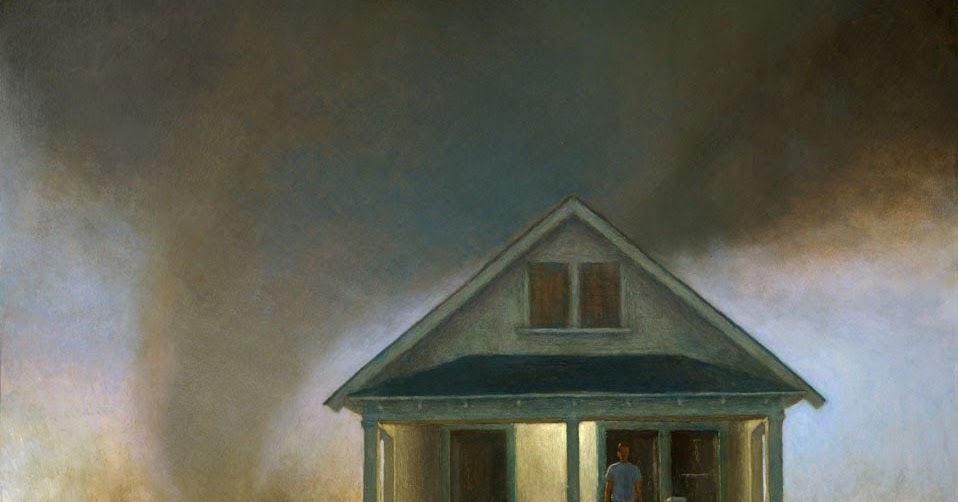
Find the location of `window`. window is located at coordinates (551, 290).